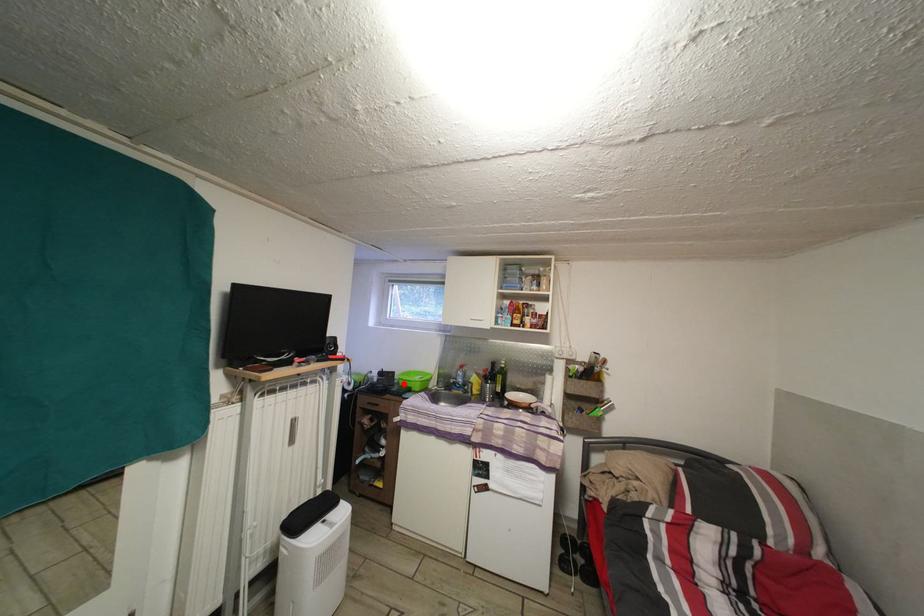
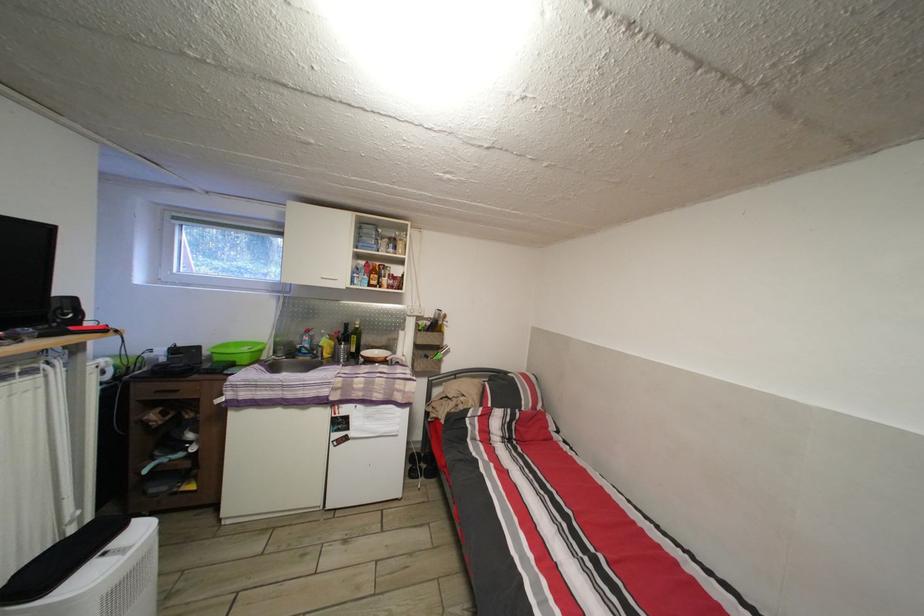
Where in the second image is the point corresponding to the highlighted location from the first image?

(213, 359)